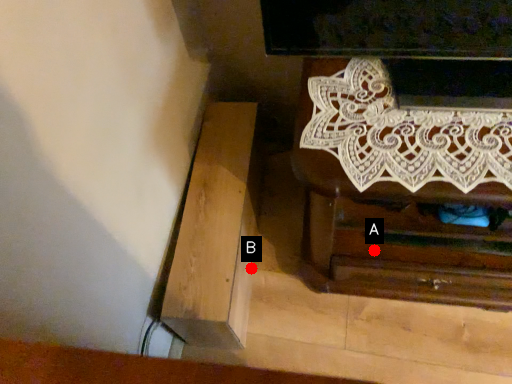
Question: Two points are circled on the image, labeled by A and B beside each circle. Which point appears farthest from the camera in this image?

Choices:
 (A) A is further
 (B) B is further

Answer: (B)